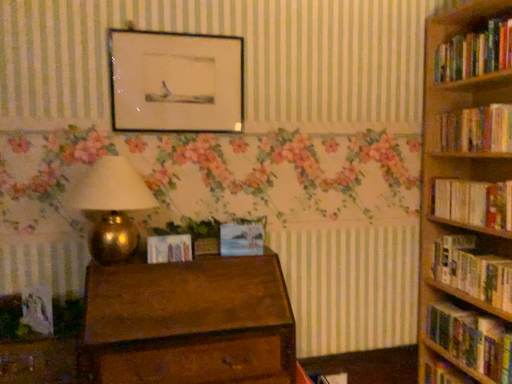
Question: In terms of width, does pastel blue canvas painting at center, which appears as the 2th paperback book when viewed from the left, look wider or thinner when compared to wooden drawer at lower left?

Choices:
 (A) thin
 (B) wide

Answer: (A)

Question: From a real-world perspective, is pastel blue canvas painting at center, which appears as the 2th paperback book when viewed from the left, physically located above or below wooden drawer at lower left?

Choices:
 (A) above
 (B) below

Answer: (A)

Question: Which of these objects is positioned farthest from the gold metallic table lamp at left?

Choices:
 (A) pastel blue canvas painting at center, which appears as the 2th paperback book when viewed from the left
 (B) hardcover books at right, the first book ordered from the bottom
 (C) wooden chest of drawers at center
 (D) matte paper photo frame at center, marked as the second paperback book in a right-to-left arrangement
 (E) matte black picture frame at upper center

Answer: (B)

Question: Which is nearer to the wooden chest of drawers at center?

Choices:
 (A) hardcover books at right, the 1th book from the top
 (B) wooden bookshelf at right
 (C) hardcover books at right, the first book ordered from the bottom
 (D) matte black picture frame at upper center
 (E) hardcover books at right, which ranks as the 4th book in bottom-to-top order

Answer: (D)